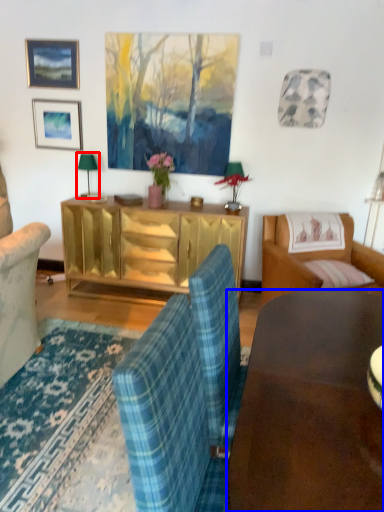
Question: Which of the following is the farthest to the observer, lamp (highlighted by a red box) or desk (highlighted by a blue box)?

Choices:
 (A) lamp
 (B) desk

Answer: (A)